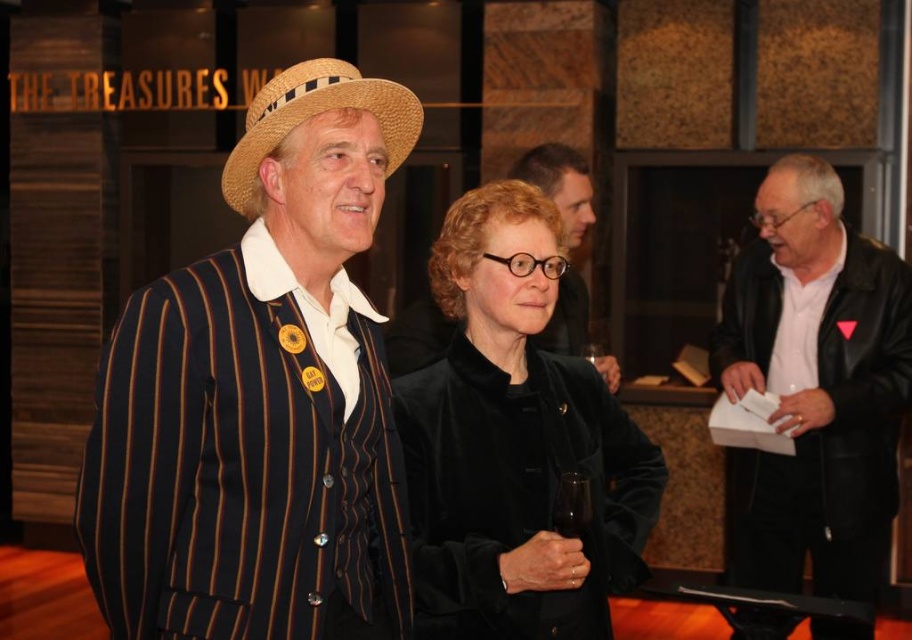
Does strawhat at center have a larger size compared to transparent glass at center?

Correct, strawhat at center is larger in size than transparent glass at center.

Does strawhat at center appear on the left side of transparent glass at center?

Indeed, strawhat at center is positioned on the left side of transparent glass at center.

The height and width of the screenshot is (640, 912). What do you see at coordinates (313, 115) in the screenshot? I see `strawhat at center` at bounding box center [313, 115].

I want to click on strawhat at center, so pyautogui.click(x=313, y=115).

Can you confirm if black leather jacket at right is bigger than transparent glass at center?

Yes, black leather jacket at right is bigger than transparent glass at center.

Based on the photo, who is shorter, black leather jacket at right or transparent glass at center?

transparent glass at center

Measure the distance between point (x=806, y=365) and camera.

Point (x=806, y=365) and camera are 10.92 feet apart.

The width and height of the screenshot is (912, 640). I want to click on black leather jacket at right, so click(x=815, y=387).

Does point (83, 520) lie behind point (337, 104)?

No.

In the scene shown: Can you confirm if striped fabric suit at center is bigger than strawhat at center?

Yes.

Between point (218, 545) and point (314, 60), which one is positioned in front?

Point (218, 545)

At what (x,y) coordinates should I click in order to perform the action: click on striped fabric suit at center. Please return your answer as a coordinate pair (x, y). Looking at the image, I should click on (260, 396).